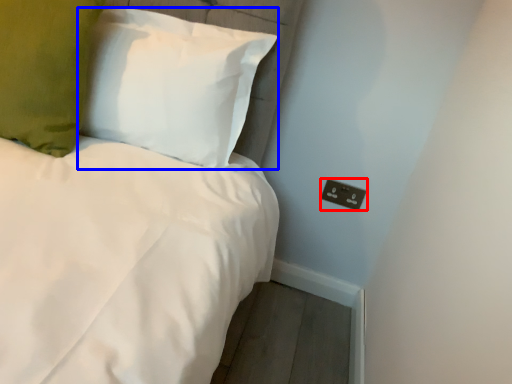
Question: Among these objects, which one is nearest to the camera, electric outlet (highlighted by a red box) or pillow (highlighted by a blue box)?

Choices:
 (A) electric outlet
 (B) pillow

Answer: (B)